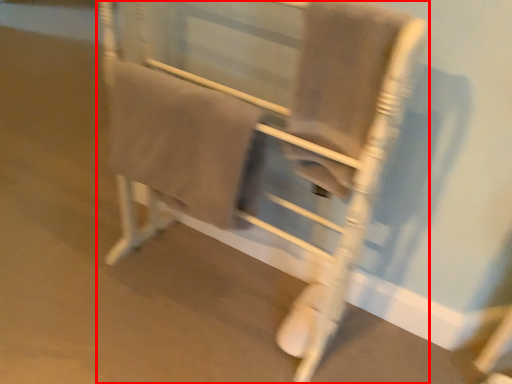
Question: Considering the relative positions of furniture (annotated by the red box) and bath towel in the image provided, where is furniture (annotated by the red box) located with respect to the staircase?

Choices:
 (A) right
 (B) left

Answer: (A)